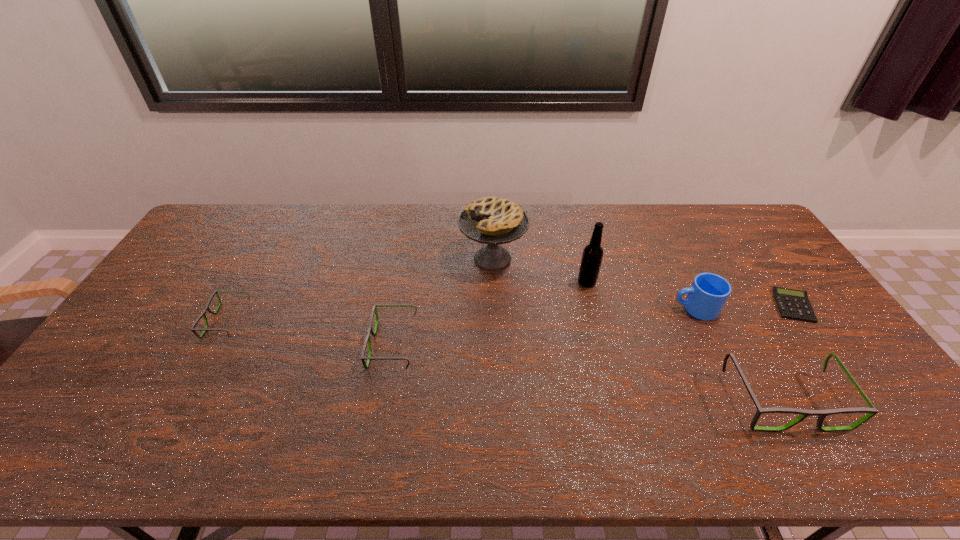
Please point a location where one more spectacles can be added evenly. Please provide its 2D coordinates. Your answer should be formatted as a tuple, i.e. [(x, y)], where the tuple contains the x and y coordinates of a point satisfying the conditions above.

[(577, 371)]